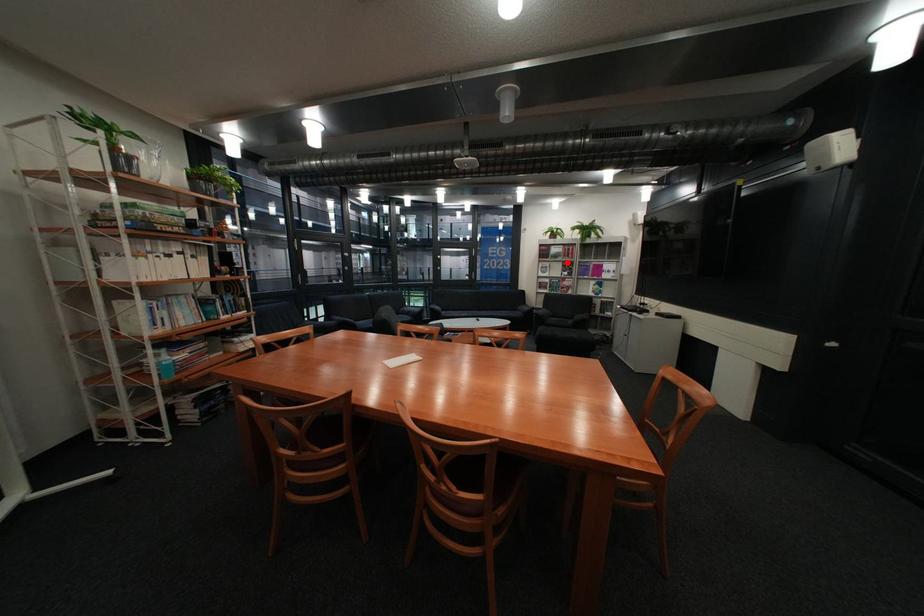
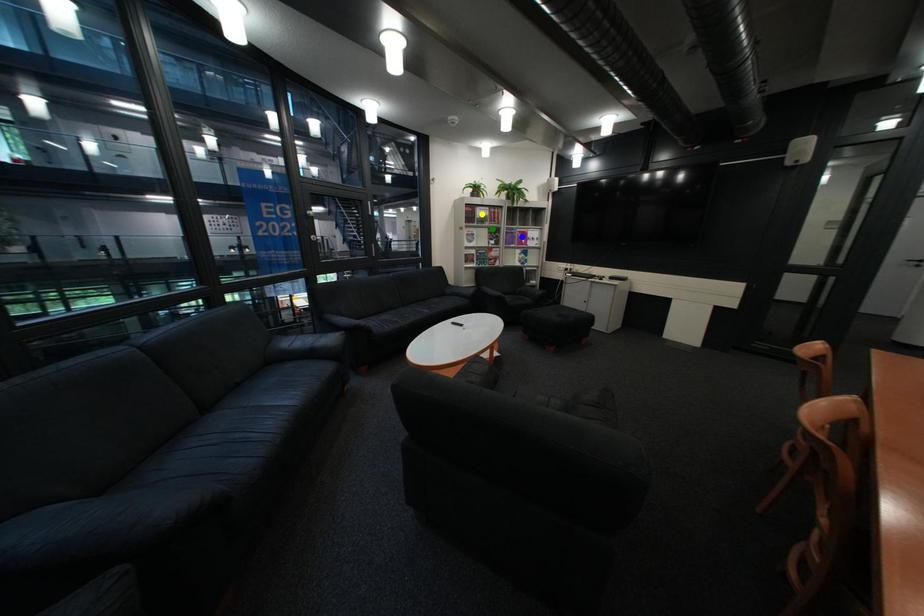
Question: I am providing you with two images of the same scene from different viewpoints. A red point is marked on the first image. You are given multiple points on the second image. Which mark in image 2 goes with the point in image 1?

Choices:
 (A) yellow point
 (B) blue point
 (C) green point

Answer: (C)